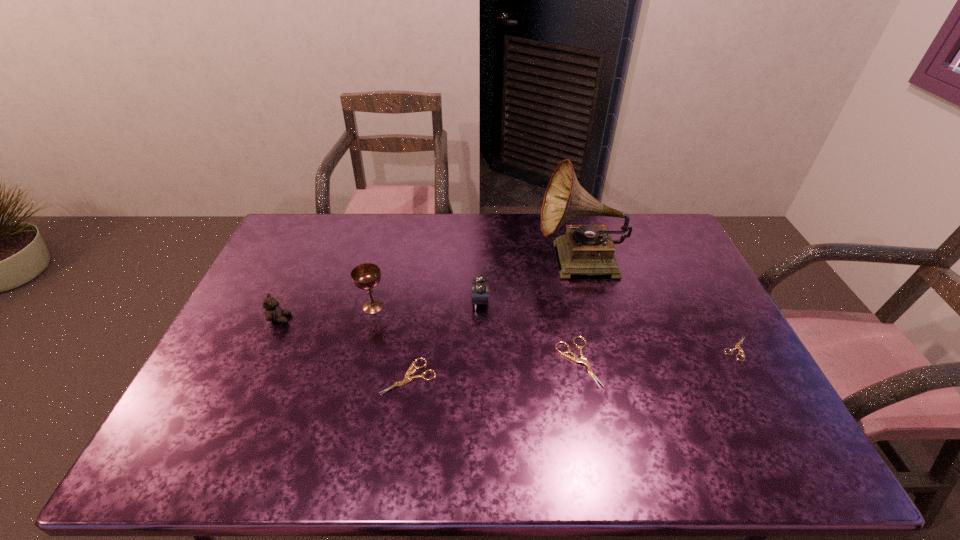
At what (x,y) coordinates should I click in order to perform the action: click on blank region between the second shears from left to right and the rightmost object. Please return your answer as a coordinate pair (x, y). The width and height of the screenshot is (960, 540). Looking at the image, I should click on click(x=658, y=355).

The image size is (960, 540). Identify the location of vacant space in between the leftmost object and the chalice. (326, 313).

Image resolution: width=960 pixels, height=540 pixels. Identify the location of free space between the rightmost shears and the chalice. (555, 327).

Where is `vacant area that lies between the third object from left to right and the tallest object`? The height and width of the screenshot is (540, 960). vacant area that lies between the third object from left to right and the tallest object is located at coordinates (494, 320).

What are the coordinates of `free spot between the alarm clock and the sixth shortest object` in the screenshot? It's located at (426, 304).

Where is `free space between the second shears from right to left and the second shortest object`? Image resolution: width=960 pixels, height=540 pixels. free space between the second shears from right to left and the second shortest object is located at coordinates [x=493, y=369].

The width and height of the screenshot is (960, 540). In order to click on unoccupied area between the fourth object from left to right and the second tallest object in this screenshot , I will do `click(426, 304)`.

Locate an element on the screen. free space between the sixth tallest object and the tallest object is located at coordinates (494, 320).

Where is `free space that is in between the rightmost object and the fifth object from right to left`? Image resolution: width=960 pixels, height=540 pixels. free space that is in between the rightmost object and the fifth object from right to left is located at coordinates (573, 362).

Where is `the third closest object to the tallest object`? This screenshot has width=960, height=540. the third closest object to the tallest object is located at coordinates (737, 346).